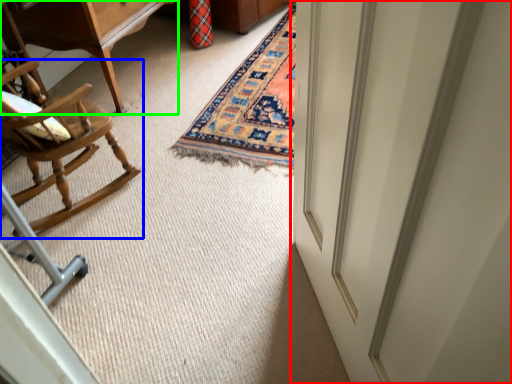
Question: Which object is positioned closest to door (highlighted by a red box)? Select from chair (highlighted by a blue box) and table (highlighted by a green box).

Choices:
 (A) chair
 (B) table

Answer: (A)